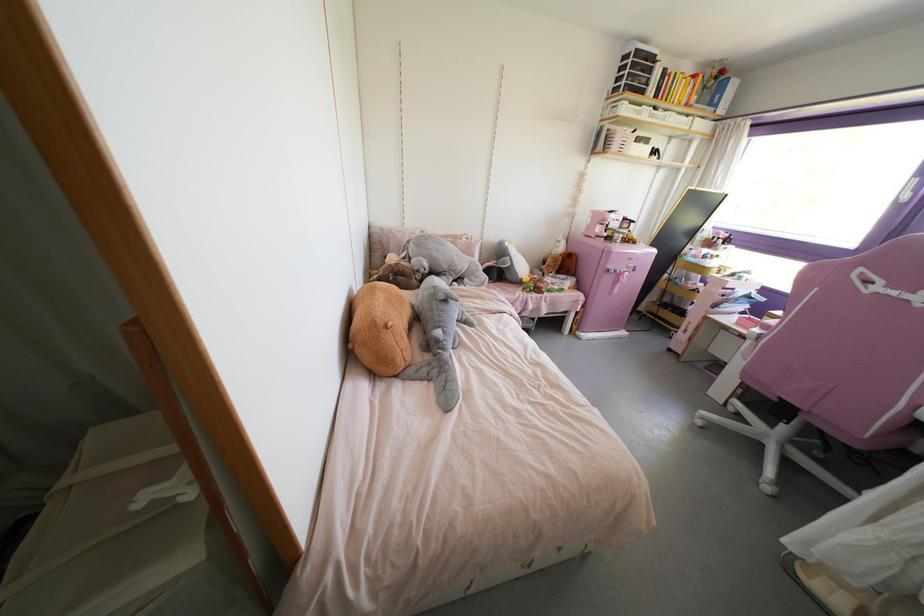
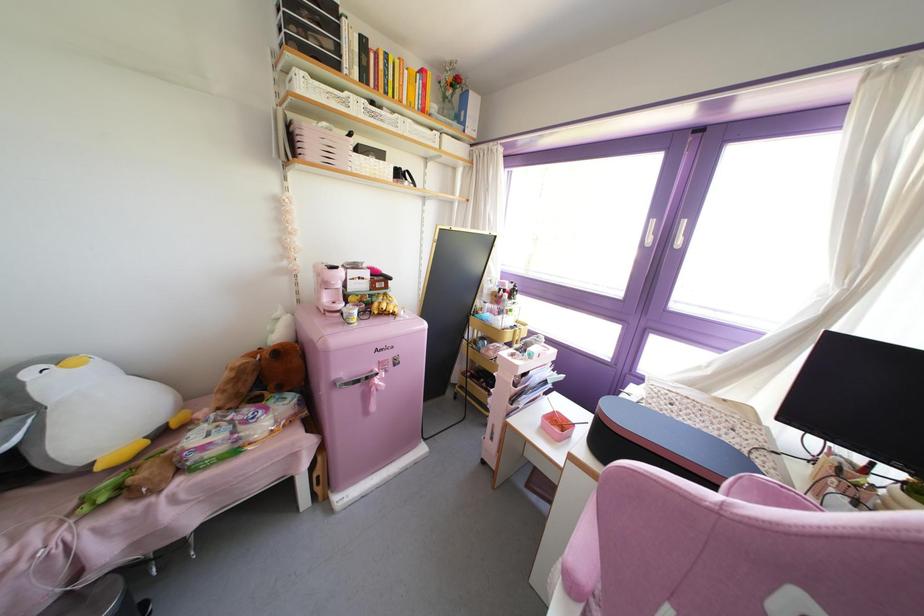
Find the pixel in the second image that matches the point at 639,145 in the first image.

(371, 160)